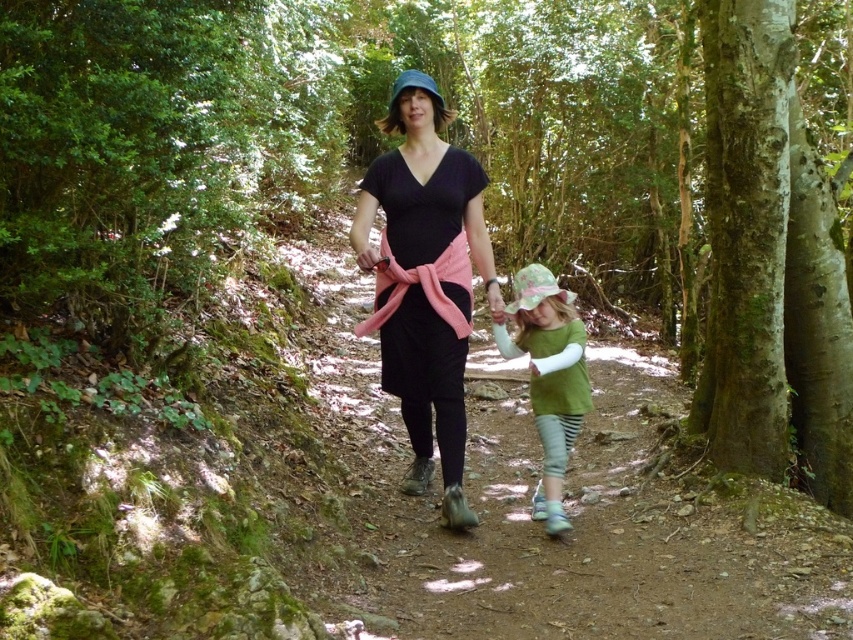
Which is more to the left, matte black dress at center or green cotton shirt at center?

matte black dress at center is more to the left.

Does matte black dress at center have a greater width compared to green cotton shirt at center?

Yes, matte black dress at center is wider than green cotton shirt at center.

Where is `matte black dress at center`? matte black dress at center is located at coordinates (425, 280).